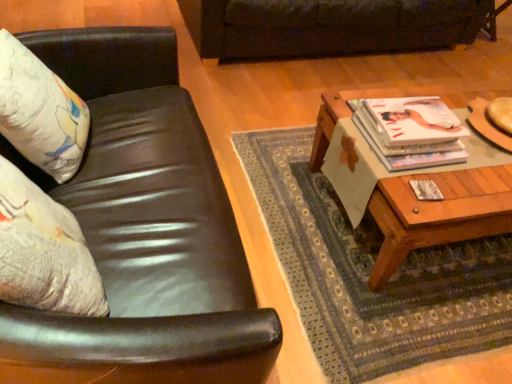
Locate an element on the screen. The height and width of the screenshot is (384, 512). vacant area that lies between woodenwoodencoffee table at right and black leather couch at left, the second studio couch positioned from the back is located at coordinates (x=315, y=251).